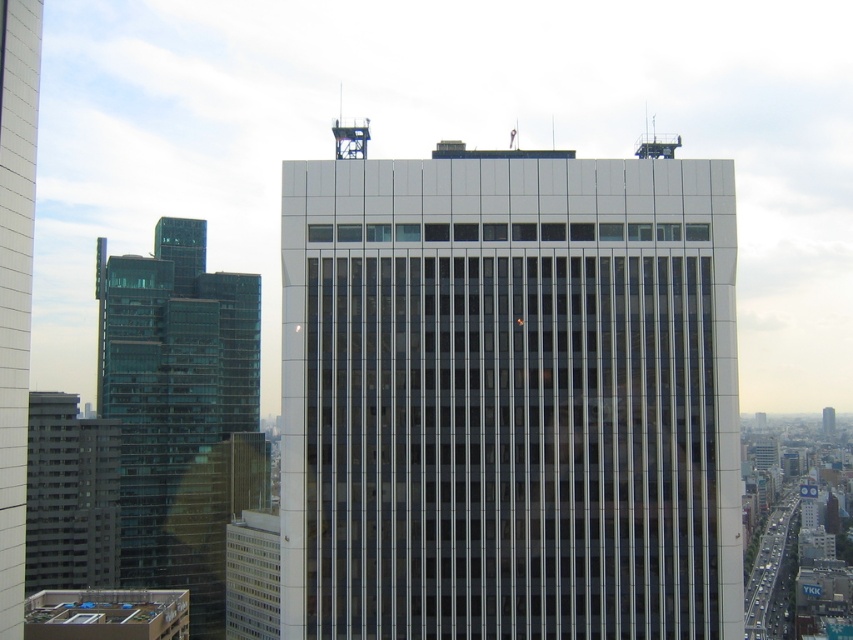
Does transparent glass building at left lie behind glassy reflective skyscraper at center?

That is True.

Where is `transparent glass building at left`? The height and width of the screenshot is (640, 853). transparent glass building at left is located at coordinates (180, 410).

Find the location of a particular element. transparent glass building at left is located at coordinates (180, 410).

Is point (688, 429) positioned in front of point (204, 634)?

Yes, it is.

Which of these two, white glass building at center or transparent glass building at left, stands taller?

With more height is transparent glass building at left.

Is point (473, 339) positioned before point (138, 326)?

That is True.

Identify the location of white glass building at center. The height and width of the screenshot is (640, 853). (508, 396).

Which of these two, white glass building at center or transparent glass windows at lower left, stands taller?

With more height is white glass building at center.

Based on the photo, can you confirm if white glass building at center is positioned to the right of transparent glass windows at lower left?

Correct, you'll find white glass building at center to the right of transparent glass windows at lower left.

Who is more forward, (392, 248) or (242, 540)?

Point (392, 248) is more forward.

At what (x,y) coordinates should I click in order to perform the action: click on white glass building at center. Please return your answer as a coordinate pair (x, y). Looking at the image, I should click on pos(508,396).